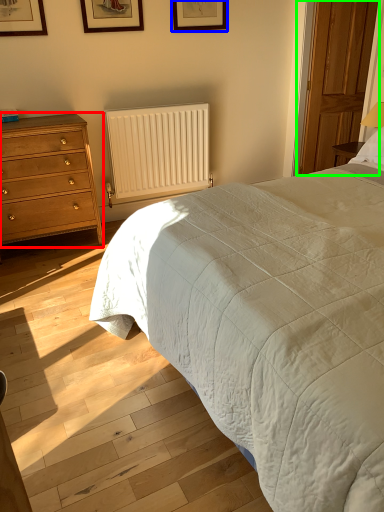
Question: Which object is the farthest from chest of drawers (highlighted by a red box)? Choose among these: picture frame (highlighted by a blue box) or glass door (highlighted by a green box).

Choices:
 (A) picture frame
 (B) glass door

Answer: (B)